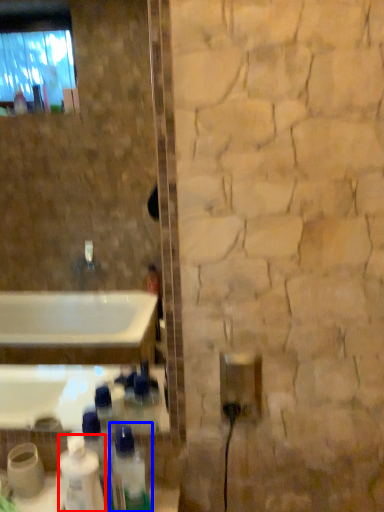
Question: Which of the following is the farthest to the observer, cleaning product (highlighted by a red box) or bottle (highlighted by a blue box)?

Choices:
 (A) cleaning product
 (B) bottle

Answer: (B)